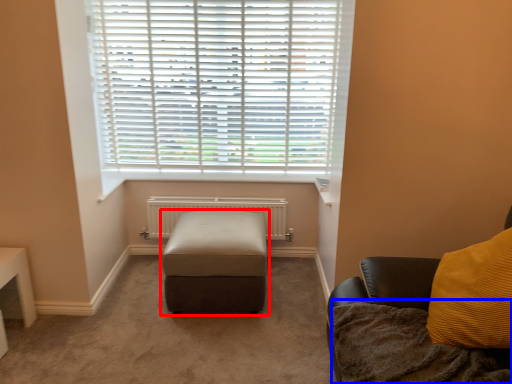
Question: Which object appears farthest to the camera in this image, furniture (highlighted by a red box) or blanket (highlighted by a blue box)?

Choices:
 (A) furniture
 (B) blanket

Answer: (A)